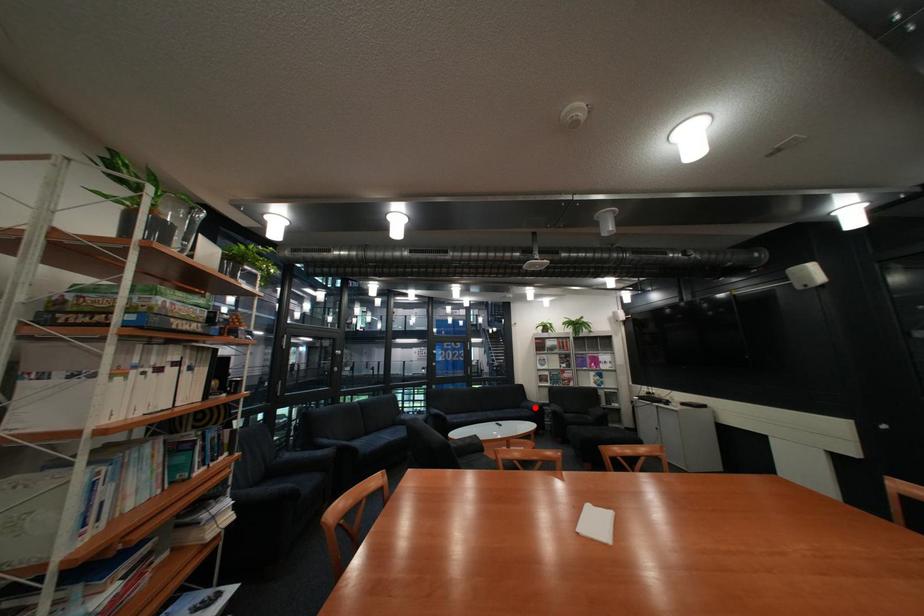
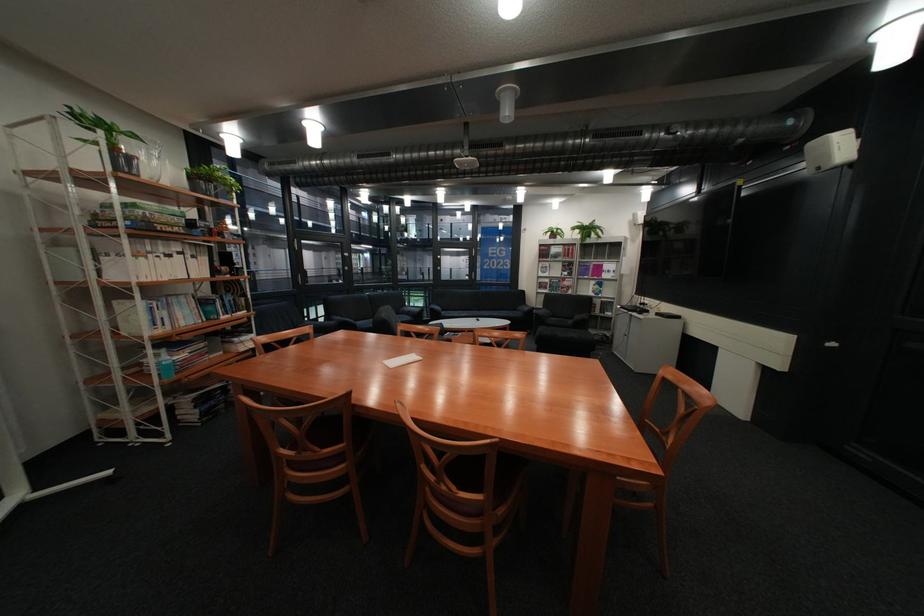
In the second image, find the point that corresponds to the highlighted location in the first image.

(531, 310)